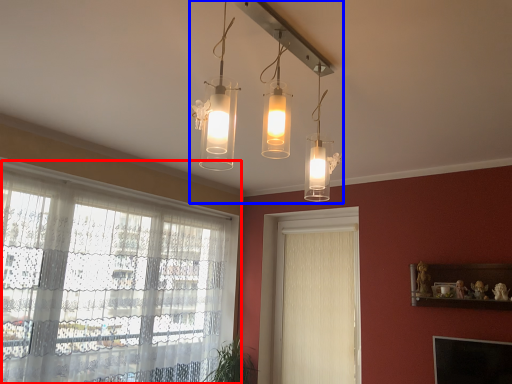
Question: Which of the following is the closest to the observer, window (highlighted by a red box) or light fixture (highlighted by a blue box)?

Choices:
 (A) window
 (B) light fixture

Answer: (B)